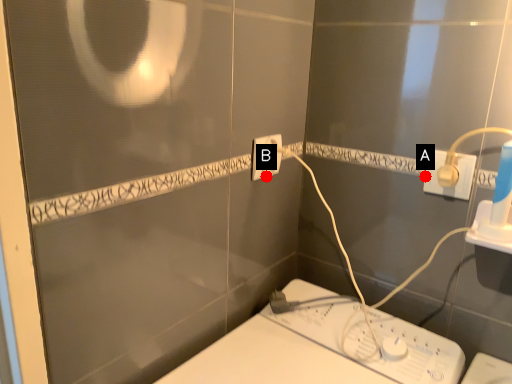
Question: Two points are circled on the image, labeled by A and B beside each circle. Which point is farther to the camera?

Choices:
 (A) A is further
 (B) B is further

Answer: (B)